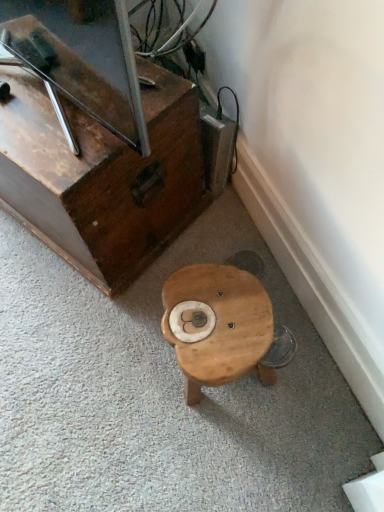
Question: Is wooden stool at center inside wooden chest at lower left?

Choices:
 (A) yes
 (B) no

Answer: (B)

Question: Does wooden chest at lower left have a greater width compared to wooden stool at center?

Choices:
 (A) no
 (B) yes

Answer: (B)

Question: Could you tell me if wooden chest at lower left is facing wooden stool at center?

Choices:
 (A) no
 (B) yes

Answer: (A)

Question: Would you consider wooden chest at lower left to be distant from wooden stool at center?

Choices:
 (A) yes
 (B) no

Answer: (B)

Question: Is wooden chest at lower left turned away from wooden stool at center?

Choices:
 (A) yes
 (B) no

Answer: (B)

Question: Can you confirm if wooden chest at lower left is bigger than wooden stool at center?

Choices:
 (A) yes
 (B) no

Answer: (A)

Question: From a real-world perspective, does wooden stool at center stand above wooden chest at lower left?

Choices:
 (A) no
 (B) yes

Answer: (A)

Question: Considering the relative sizes of wooden stool at center and wooden chest at lower left in the image provided, is wooden stool at center wider than wooden chest at lower left?

Choices:
 (A) yes
 (B) no

Answer: (B)

Question: From a real-world perspective, is wooden stool at center beneath wooden chest at lower left?

Choices:
 (A) yes
 (B) no

Answer: (A)

Question: Considering the relative sizes of wooden stool at center and wooden chest at lower left in the image provided, is wooden stool at center thinner than wooden chest at lower left?

Choices:
 (A) yes
 (B) no

Answer: (A)

Question: Considering the relative positions of wooden stool at center and wooden chest at lower left in the image provided, is wooden stool at center behind wooden chest at lower left?

Choices:
 (A) yes
 (B) no

Answer: (B)

Question: Is wooden stool at center at the left side of wooden chest at lower left?

Choices:
 (A) yes
 (B) no

Answer: (B)

Question: In terms of height, does wooden chest at lower left look taller or shorter compared to wooden stool at center?

Choices:
 (A) short
 (B) tall

Answer: (B)